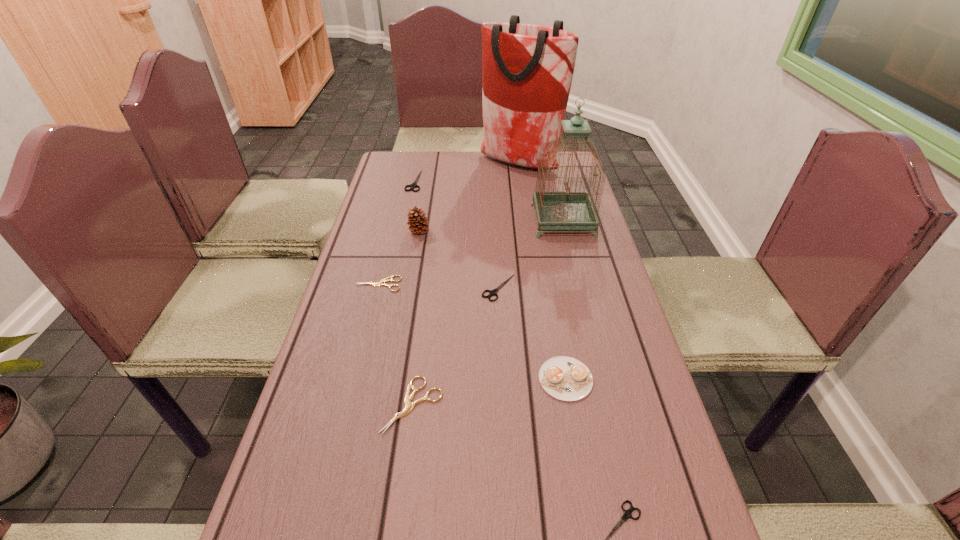
This screenshot has height=540, width=960. Find the location of `free space located 0.190m on the left of the fourth tallest object`. free space located 0.190m on the left of the fourth tallest object is located at coordinates (452, 379).

The image size is (960, 540). In order to click on vacant space located on the front of the biggest black shears in this screenshot , I will do `click(399, 247)`.

Where is `vacant space located on the back of the second shears from right to left`? The image size is (960, 540). vacant space located on the back of the second shears from right to left is located at coordinates (494, 204).

Where is `free spot located on the back of the bigger beige shears`? free spot located on the back of the bigger beige shears is located at coordinates (430, 269).

In order to click on vacant position located on the back of the farther beige shears in this screenshot , I will do `click(391, 235)`.

Locate an element on the screen. This screenshot has height=540, width=960. grocery bag present at the far edge is located at coordinates (527, 70).

You are a GUI agent. You are given a task and a screenshot of the screen. Output one action in this format:
    pyautogui.click(x=<x>, y=<y>)
    Task: Click on the shears at the far edge
    The width and height of the screenshot is (960, 540).
    Given the screenshot: What is the action you would take?
    pyautogui.click(x=414, y=185)

You are a GUI agent. You are given a task and a screenshot of the screen. Output one action in this format:
    pyautogui.click(x=<x>, y=<y>)
    Task: Click on the pinecone that is positioned at the left edge
    The width and height of the screenshot is (960, 540).
    Given the screenshot: What is the action you would take?
    pyautogui.click(x=417, y=223)

You are a GUI agent. You are given a task and a screenshot of the screen. Output one action in this format:
    pyautogui.click(x=<x>, y=<y>)
    Task: Click on the grocery bag that is positioned at the right edge
    This screenshot has width=960, height=540.
    Given the screenshot: What is the action you would take?
    pyautogui.click(x=527, y=70)

At what (x,y) coordinates should I click in order to perform the action: click on birdcage at the right edge. Please return your answer as a coordinate pair (x, y). This screenshot has width=960, height=540. Looking at the image, I should click on [556, 210].